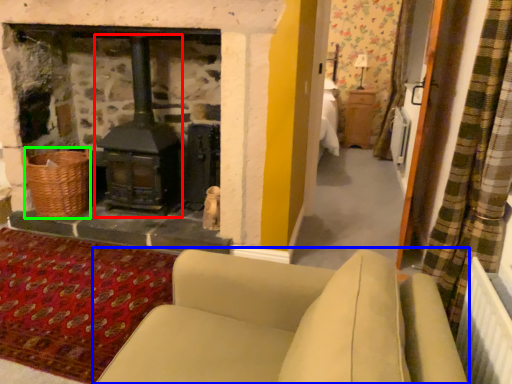
Question: Considering the real-world distances, which object is farthest from wood burning stove (highlighted by a red box)? studio couch (highlighted by a blue box) or basket (highlighted by a green box)?

Choices:
 (A) studio couch
 (B) basket

Answer: (A)